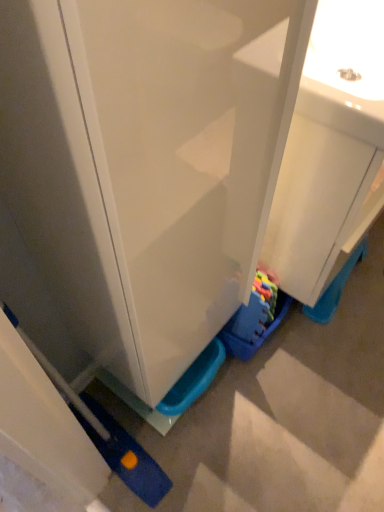
Question: From the image's perspective, relative to white glossy sink at center, is matte white cabinet at center above or below?

Choices:
 (A) above
 (B) below

Answer: (B)

Question: Visually, is matte white cabinet at center positioned to the left or to the right of white glossy sink at center?

Choices:
 (A) left
 (B) right

Answer: (A)

Question: Estimate the real-world distances between objects in this image. Which object is closer to the white glossy sink at center?

Choices:
 (A) rubberized plastic toy at lower center
 (B) matte white cabinet at center

Answer: (B)

Question: Which is nearer to the rubberized plastic toy at lower center?

Choices:
 (A) matte white cabinet at center
 (B) white glossy sink at center

Answer: (B)